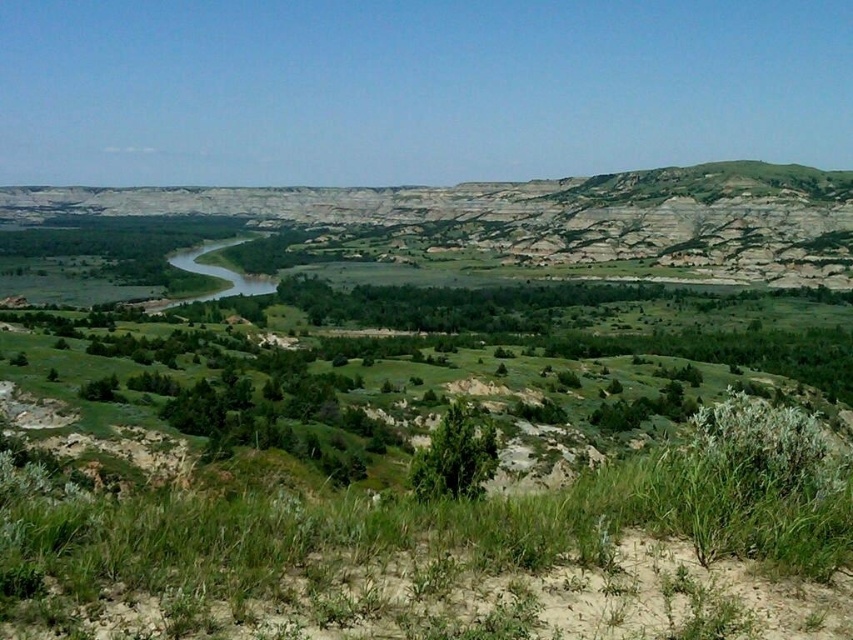
You are planning a hiking route through this landscape and need to decide whether to go around the rugged stone mountain at center or the green leafy bush at center. Which one requires a wider path due to its size?

The rugged stone mountain at center is bigger than the green leafy bush at center, so you need to create a wider path around the rugged stone mountain at center.

You are planning to set up a tent for a camping trip and need to choose between the rugged stone mountain at center and the green leafy bush at center. Which location offers more horizontal space for your tent?

The rugged stone mountain at center might be wider than green leafy bush at center, so it likely provides more horizontal space for setting up the tent.

You are a hiker standing at the base of the rugged stone mountain at center and the green leafy bush at center. Which object is higher from your perspective?

The rugged stone mountain at center is higher than the green leafy bush at center from your perspective.